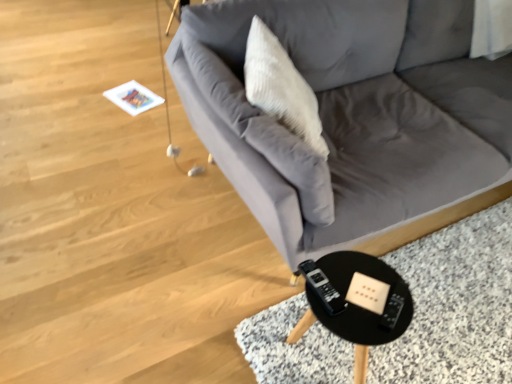
This screenshot has height=384, width=512. I want to click on gray fabric couch at center, so click(349, 114).

From the image's perspective, would you say white textured pillow at upper center is positioned over gray fabric couch at center?

Incorrect, from the image's perspective, white textured pillow at upper center is lower than gray fabric couch at center.

Which is more to the right, white textured pillow at upper center or gray fabric couch at center?

From the viewer's perspective, gray fabric couch at center appears more on the right side.

Is white textured pillow at upper center oriented towards gray fabric couch at center?

Yes, white textured pillow at upper center is oriented towards gray fabric couch at center.

Is white textured pillow at upper center not within gray fabric couch at center?

No, white textured pillow at upper center is not entirely external to gray fabric couch at center.

The image size is (512, 384). Find the location of `studio couch that appears above the black plastic table at lower right (from the image's perspective)`. studio couch that appears above the black plastic table at lower right (from the image's perspective) is located at coordinates (349, 114).

Is black plastic table at lower right bigger or smaller than gray fabric couch at center?

Considering their sizes, black plastic table at lower right takes up less space than gray fabric couch at center.

From the picture: Considering the relative sizes of black plastic table at lower right and gray fabric couch at center in the image provided, is black plastic table at lower right wider than gray fabric couch at center?

No, black plastic table at lower right is not wider than gray fabric couch at center.

From a real-world perspective, is white textured pillow at upper center located beneath black plastic table at lower right?

No, from a real-world perspective, white textured pillow at upper center is not under black plastic table at lower right.

Is white textured pillow at upper center positioned in front of black plastic table at lower right?

No, white textured pillow at upper center is further to the viewer.

Based on the photo, which of these two, white textured pillow at upper center or black plastic table at lower right, is smaller?

Smaller between the two is black plastic table at lower right.

Considering the sizes of objects white textured pillow at upper center and black plastic table at lower right in the image provided, who is shorter, white textured pillow at upper center or black plastic table at lower right?

With less height is black plastic table at lower right.

Which is correct: black plastic table at lower right is inside white textured pillow at upper center, or outside of it?

black plastic table at lower right is not enclosed by white textured pillow at upper center.

From the image's perspective, is black plastic table at lower right positioned above or below white textured pillow at upper center?

black plastic table at lower right is situated lower than white textured pillow at upper center in the image.

Can you see black plastic table at lower right touching white textured pillow at upper center?

No, black plastic table at lower right is not in contact with white textured pillow at upper center.

Between black plastic table at lower right and white textured pillow at upper center, which one is positioned in front?

Positioned in front is black plastic table at lower right.

Who is smaller, gray fabric couch at center or white textured pillow at upper center?

white textured pillow at upper center is smaller.

Does point (412, 56) lie in front of point (301, 87)?

No, (412, 56) is behind (301, 87).

Can you confirm if gray fabric couch at center is wider than white textured pillow at upper center?

Yes.

Choose the correct answer: Is gray fabric couch at center inside black plastic table at lower right or outside it?

gray fabric couch at center is outside black plastic table at lower right.

Is point (432, 69) farther from viewer compared to point (305, 324)?

Yes, point (432, 69) is behind point (305, 324).

Identify the location of table below the gray fabric couch at center (from a real-world perspective). 355,302.

Are gray fabric couch at center and black plastic table at lower right beside each other?

No, gray fabric couch at center is not in contact with black plastic table at lower right.

This screenshot has height=384, width=512. What are the coordinates of `studio couch on the right of white textured pillow at upper center` in the screenshot? It's located at (x=349, y=114).

The width and height of the screenshot is (512, 384). I want to click on table below the gray fabric couch at center (from the image's perspective), so click(x=355, y=302).

From the image, which object appears to be farther from black plastic table at lower right, white textured pillow at upper center or gray fabric couch at center?

The object further to black plastic table at lower right is gray fabric couch at center.

When comparing their distances from white textured pillow at upper center, does black plastic table at lower right or gray fabric couch at center seem closer?

gray fabric couch at center.

Considering their positions, is white textured pillow at upper center positioned further to gray fabric couch at center than black plastic table at lower right?

black plastic table at lower right lies further to gray fabric couch at center than the other object.

Looking at the image, which one is located closer to black plastic table at lower right, gray fabric couch at center or white textured pillow at upper center?

white textured pillow at upper center.

From the image, which object appears to be nearer to gray fabric couch at center, black plastic table at lower right or white textured pillow at upper center?

white textured pillow at upper center is positioned closer to the anchor gray fabric couch at center.

When comparing their distances from white textured pillow at upper center, does gray fabric couch at center or black plastic table at lower right seem further?

black plastic table at lower right lies further to white textured pillow at upper center than the other object.

The width and height of the screenshot is (512, 384). What are the coordinates of `throw pillow between gray fabric couch at center and black plastic table at lower right in the up-down direction` in the screenshot? It's located at (281, 87).